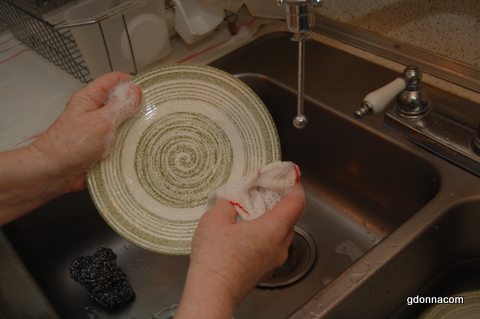
Where is `sink strainer`? This screenshot has width=480, height=319. sink strainer is located at coordinates (292, 265).